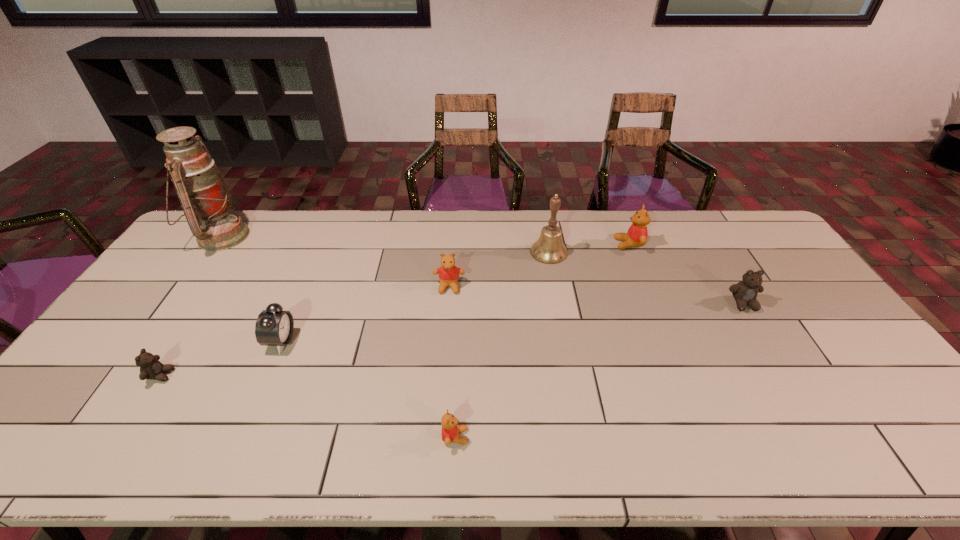
Locate an element on the screen. This screenshot has height=540, width=960. the tallest object is located at coordinates (205, 198).

Image resolution: width=960 pixels, height=540 pixels. In order to click on red oil lamp in this screenshot , I will do `click(205, 198)`.

Locate an element on the screen. The height and width of the screenshot is (540, 960). the seventh shortest object is located at coordinates (549, 249).

The width and height of the screenshot is (960, 540). Find the location of `bell`. bell is located at coordinates (549, 249).

Where is `the farthest teddy bear`? The height and width of the screenshot is (540, 960). the farthest teddy bear is located at coordinates pos(637,234).

This screenshot has height=540, width=960. I want to click on the farthest red teddy bear, so click(637, 234).

Where is `the bigger brown teddy bear`? The height and width of the screenshot is (540, 960). the bigger brown teddy bear is located at coordinates (745, 292).

Identify the location of the rightmost object. (745, 292).

You are a GUI agent. You are given a task and a screenshot of the screen. Output one action in this format:
    pyautogui.click(x=<x>, y=<y>)
    Task: Click on the second farthest red teddy bear
    The width and height of the screenshot is (960, 540).
    Given the screenshot: What is the action you would take?
    pyautogui.click(x=448, y=273)

The height and width of the screenshot is (540, 960). What are the coordinates of `the sixth object from right to left` in the screenshot? It's located at (274, 327).